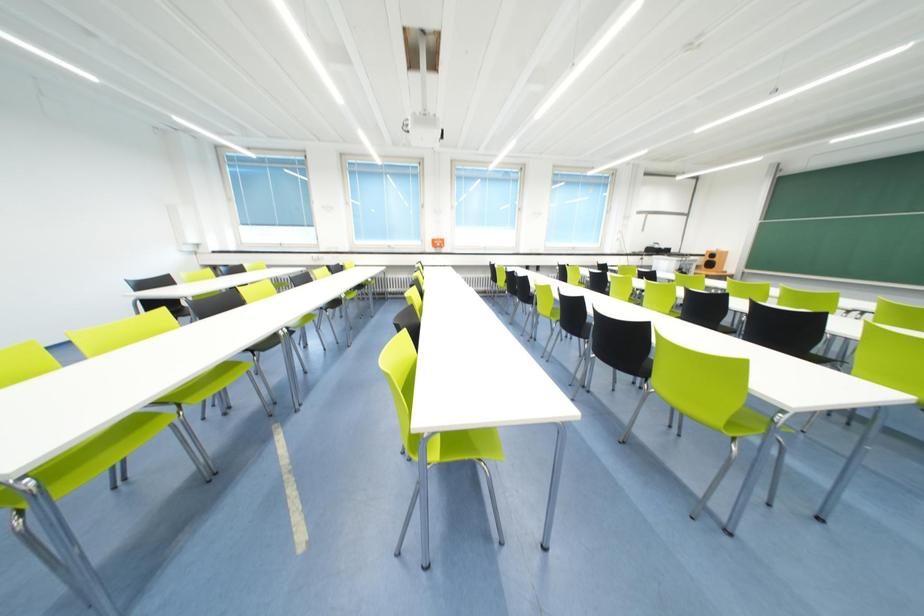
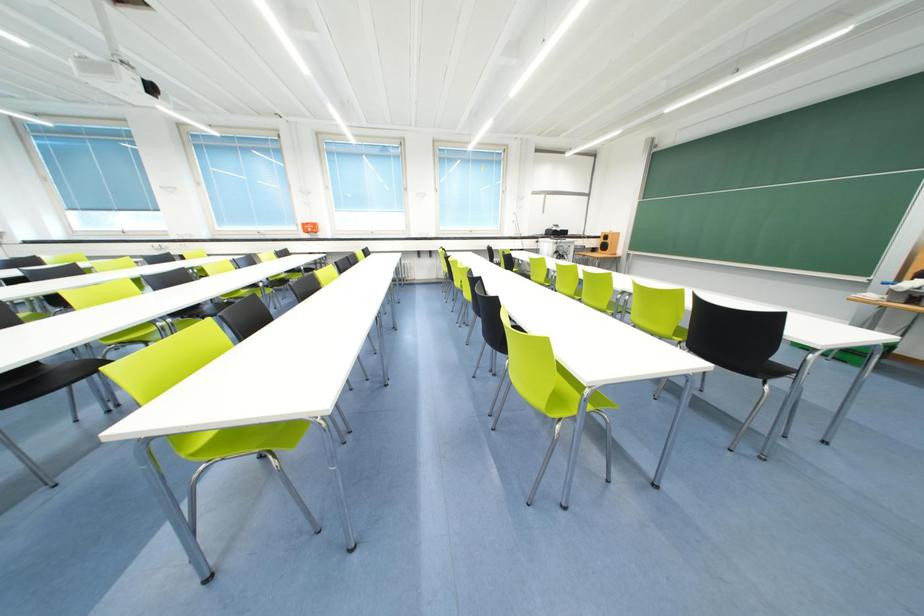
Question: What movement of the cameraman would produce the second image?

Choices:
 (A) Left
 (B) Right
 (C) Forward
 (D) Backward

Answer: (B)